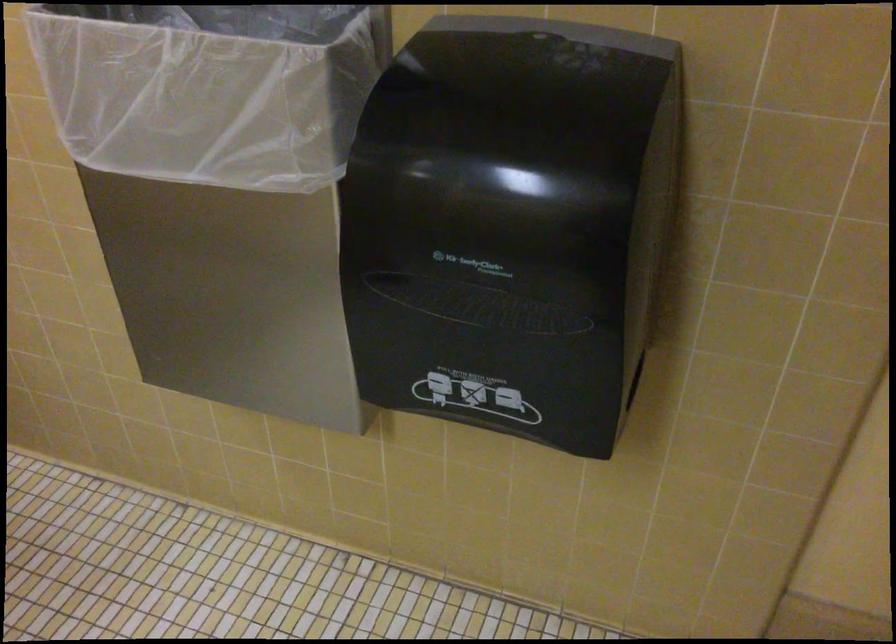
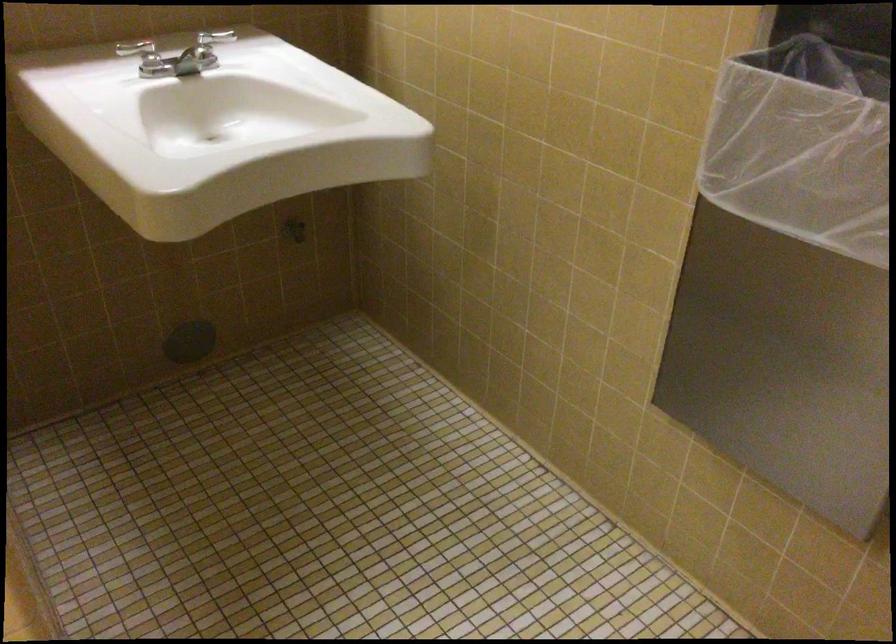
Question: The camera is either moving clockwise (left) or counter-clockwise (right) around the object. The first image is from the beginning of the video and the second image is from the end. Is the camera moving left or right when shooting the video?

Choices:
 (A) Left
 (B) Right

Answer: (B)